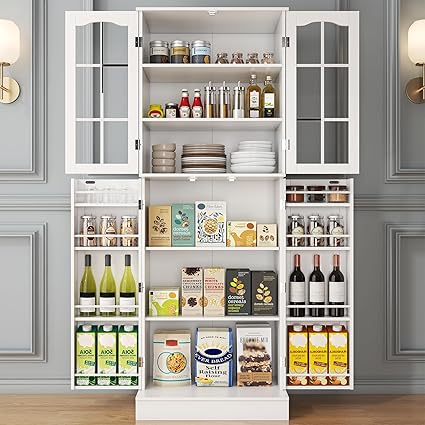
Where is `bottles`? bottles is located at coordinates (85, 294), (105, 290), (130, 287), (185, 110), (195, 106), (251, 93), (266, 94), (296, 285), (317, 287), (334, 291).